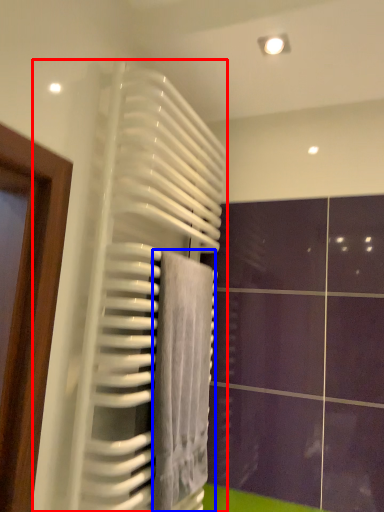
Question: Which point is closer to the camera, radiator (highlighted by a red box) or towel (highlighted by a blue box)?

Choices:
 (A) radiator
 (B) towel

Answer: (A)